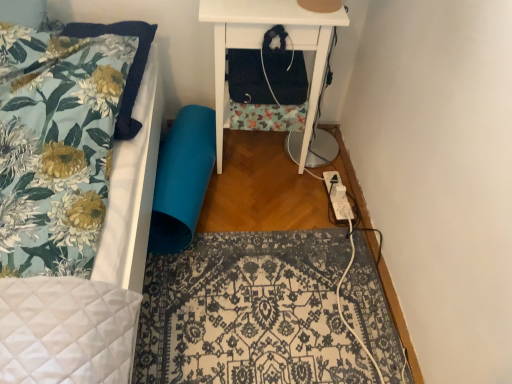
What do you see at coordinates (338, 196) in the screenshot? I see `white plastic extension cord at lower right` at bounding box center [338, 196].

Find the location of a particular element. This screenshot has width=512, height=384. white plastic extension cord at lower right is located at coordinates pyautogui.click(x=338, y=196).

In order to click on floral fabric pillow at upper left in this screenshot , I will do `click(129, 68)`.

Considering the relative sizes of teal fabric swivel chair at lower left and white plastic extension cord at lower right in the image provided, is teal fabric swivel chair at lower left bigger than white plastic extension cord at lower right?

Yes.

From a real-world perspective, which is physically above, teal fabric swivel chair at lower left or white plastic extension cord at lower right?

teal fabric swivel chair at lower left, from a real-world perspective.

Are teal fabric swivel chair at lower left and white plastic extension cord at lower right beside each other?

No, teal fabric swivel chair at lower left is not with white plastic extension cord at lower right.

Which of these two, white plastic extension cord at lower right or white matte nightstand at upper right, stands taller?

white matte nightstand at upper right is taller.

From a real-world perspective, who is located lower, white plastic extension cord at lower right or white matte nightstand at upper right?

white plastic extension cord at lower right is physically lower.

How many degrees apart are the facing directions of white plastic extension cord at lower right and white matte nightstand at upper right?

They differ by 4.49 degrees in their facing directions.

Is point (327, 174) positioned behind point (324, 329)?

Yes, point (327, 174) is behind point (324, 329).

Which object is positioned more to the right, white plastic extension cord at lower right or patterned fabric rug at center?

From the viewer's perspective, white plastic extension cord at lower right appears more on the right side.

Measure the distance from white plastic extension cord at lower right to patterned fabric rug at center.

They are 17.98 inches apart.

Are patterned fabric rug at center and floral fabric pillow at upper left located far from each other?

No.

In terms of height, does patterned fabric rug at center look taller or shorter compared to floral fabric pillow at upper left?

Clearly, patterned fabric rug at center is shorter compared to floral fabric pillow at upper left.

Considering the sizes of objects patterned fabric rug at center and floral fabric pillow at upper left in the image provided, who is smaller, patterned fabric rug at center or floral fabric pillow at upper left?

patterned fabric rug at center is smaller.

Image resolution: width=512 pixels, height=384 pixels. What are the coordinates of `mat directly beneath the floral fabric pillow at upper left (from a real-world perspective)` in the screenshot? It's located at (249, 312).

Looking at this image, considering the relative sizes of patterned fabric rug at center and teal fabric swivel chair at lower left in the image provided, is patterned fabric rug at center taller than teal fabric swivel chair at lower left?

No, patterned fabric rug at center is not taller than teal fabric swivel chair at lower left.

Are patterned fabric rug at center and teal fabric swivel chair at lower left located far from each other?

No.

How distant is patterned fabric rug at center from teal fabric swivel chair at lower left?

A distance of 13.99 inches exists between patterned fabric rug at center and teal fabric swivel chair at lower left.

Considering the relative sizes of patterned fabric rug at center and teal fabric swivel chair at lower left in the image provided, is patterned fabric rug at center smaller than teal fabric swivel chair at lower left?

Indeed, patterned fabric rug at center has a smaller size compared to teal fabric swivel chair at lower left.

Does floral fabric pillow at upper left appear on the left side of white matte nightstand at upper right?

Yes, floral fabric pillow at upper left is to the left of white matte nightstand at upper right.

Looking at the image, does floral fabric pillow at upper left seem bigger or smaller compared to white matte nightstand at upper right?

Considering their sizes, floral fabric pillow at upper left takes up less space than white matte nightstand at upper right.

In the scene shown: Between floral fabric pillow at upper left and white matte nightstand at upper right, which one has smaller width?

white matte nightstand at upper right.

From the image's perspective, between teal fabric swivel chair at lower left and patterned fabric rug at center, which one is located above?

teal fabric swivel chair at lower left.

Is point (187, 228) farther from viewer compared to point (252, 344)?

Yes, point (187, 228) is behind point (252, 344).

Find the location of a particular element. The width and height of the screenshot is (512, 384). swivel chair that is above the patterned fabric rug at center (from a real-world perspective) is located at coordinates (182, 179).

Between teal fabric swivel chair at lower left and patterned fabric rug at center, which one has larger width?

patterned fabric rug at center is wider.

Identify the location of swivel chair in front of the white plastic extension cord at lower right. This screenshot has width=512, height=384. (182, 179).

There is a white plastic extension cord at lower right. Where is `nightstand above it (from a real-world perspective)`? Image resolution: width=512 pixels, height=384 pixels. nightstand above it (from a real-world perspective) is located at coordinates (261, 45).

Which object lies nearer to the anchor point white plastic extension cord at lower right, floral fabric pillow at upper left or white matte nightstand at upper right?

Among the two, white matte nightstand at upper right is located nearer to white plastic extension cord at lower right.

Based on their spatial positions, is floral fabric pillow at upper left or white plastic extension cord at lower right further from patterned fabric rug at center?

floral fabric pillow at upper left is positioned further to the anchor patterned fabric rug at center.

Considering their positions, is patterned fabric rug at center positioned closer to white plastic extension cord at lower right than teal fabric swivel chair at lower left?

Based on the image, patterned fabric rug at center appears to be nearer to white plastic extension cord at lower right.

Based on their spatial positions, is white plastic extension cord at lower right or white matte nightstand at upper right closer to patterned fabric rug at center?

The object closer to patterned fabric rug at center is white plastic extension cord at lower right.

Which object lies further to the anchor point floral fabric pillow at upper left, white matte nightstand at upper right or patterned fabric rug at center?

Based on the image, patterned fabric rug at center appears to be further to floral fabric pillow at upper left.

Which object lies nearer to the anchor point teal fabric swivel chair at lower left, white matte nightstand at upper right or floral fabric pillow at upper left?

white matte nightstand at upper right.

When comparing their distances from patterned fabric rug at center, does teal fabric swivel chair at lower left or white plastic extension cord at lower right seem closer?

The object closer to patterned fabric rug at center is teal fabric swivel chair at lower left.

Estimate the real-world distances between objects in this image. Which object is closer to floral fabric pillow at upper left, teal fabric swivel chair at lower left or white matte nightstand at upper right?

Based on the image, teal fabric swivel chair at lower left appears to be nearer to floral fabric pillow at upper left.

Find the location of a particular element. mat located between teal fabric swivel chair at lower left and white plastic extension cord at lower right in the left-right direction is located at coordinates (249, 312).

Locate an element on the screen. This screenshot has width=512, height=384. nightstand between teal fabric swivel chair at lower left and white plastic extension cord at lower right in the horizontal direction is located at coordinates coord(261,45).

The image size is (512, 384). Identify the location of swivel chair situated between floral fabric pillow at upper left and white plastic extension cord at lower right from left to right. (182, 179).

The width and height of the screenshot is (512, 384). Find the location of `swivel chair between floral fabric pillow at upper left and white matte nightstand at upper right from left to right`. swivel chair between floral fabric pillow at upper left and white matte nightstand at upper right from left to right is located at coordinates (182, 179).